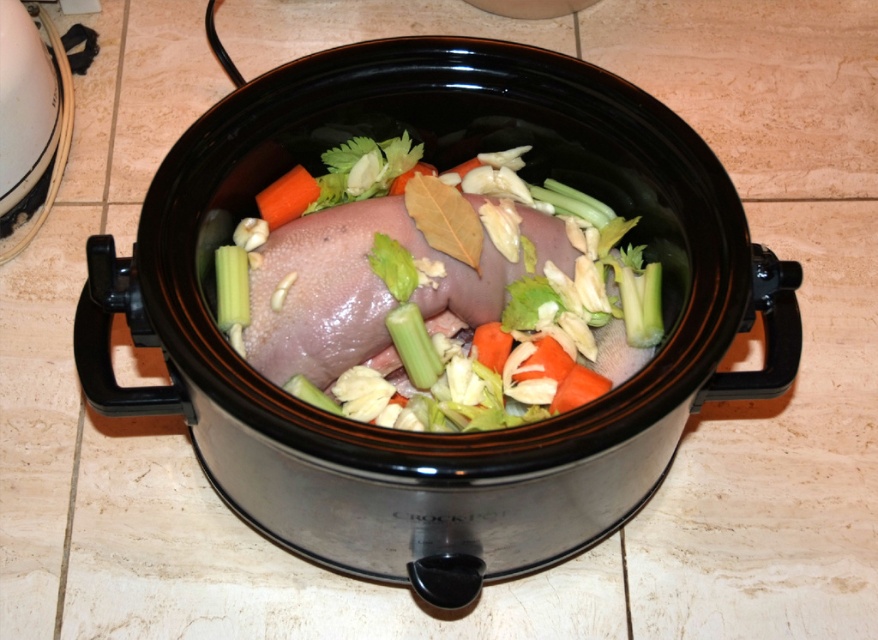
You are a chef preparing a dish and need to ensure the pink raw meat at center is fully submerged in the broth. Given that the orange smooth carrot at center is smaller, will the meat cook evenly if placed on top of the carrots?

The pink raw meat at center is larger than the orange smooth carrot at center, so placing it on top may cause uneven cooking since the meat is bulkier and might block heat distribution. Ensure the meat is fully submerged or adjust the arrangement for even cooking.

You are a chef preparing a dish and need to check the ingredients in the slow cooker. When you look into the slow cooker, which object is closer to you between the pink raw meat at center and the orange smooth carrot at center?

The pink raw meat at center is closer to you because it is in front of the orange smooth carrot at center.

Where is the pink raw meat at center located in the image?

The pink raw meat at center is located at point (436, 296) in the image.